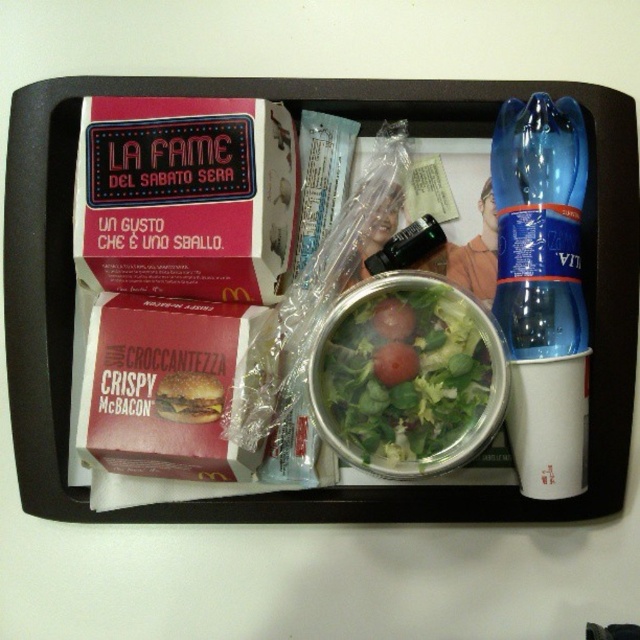
Is point (17, 280) farther from camera compared to point (356, 289)?

That is False.

Does clear plastic salad bowl at center have a larger size compared to green leafy salad at center?

Correct, clear plastic salad bowl at center is larger in size than green leafy salad at center.

Is point (634, 323) more distant than point (364, 298)?

That is False.

At what (x,y) coordinates should I click in order to perform the action: click on clear plastic salad bowl at center. Please return your answer as a coordinate pair (x, y). Image resolution: width=640 pixels, height=640 pixels. Looking at the image, I should click on (362, 132).

Does green leafy salad at center appear over crispy golden-brown mcbacon at center?

Correct, green leafy salad at center is located above crispy golden-brown mcbacon at center.

What do you see at coordinates (406, 376) in the screenshot? I see `green leafy salad at center` at bounding box center [406, 376].

The image size is (640, 640). I want to click on green leafy salad at center, so coord(406,376).

Image resolution: width=640 pixels, height=640 pixels. What do you see at coordinates (186, 196) in the screenshot? I see `matte pink cardboard box at upper left` at bounding box center [186, 196].

The width and height of the screenshot is (640, 640). Identify the location of matte pink cardboard box at upper left. (186, 196).